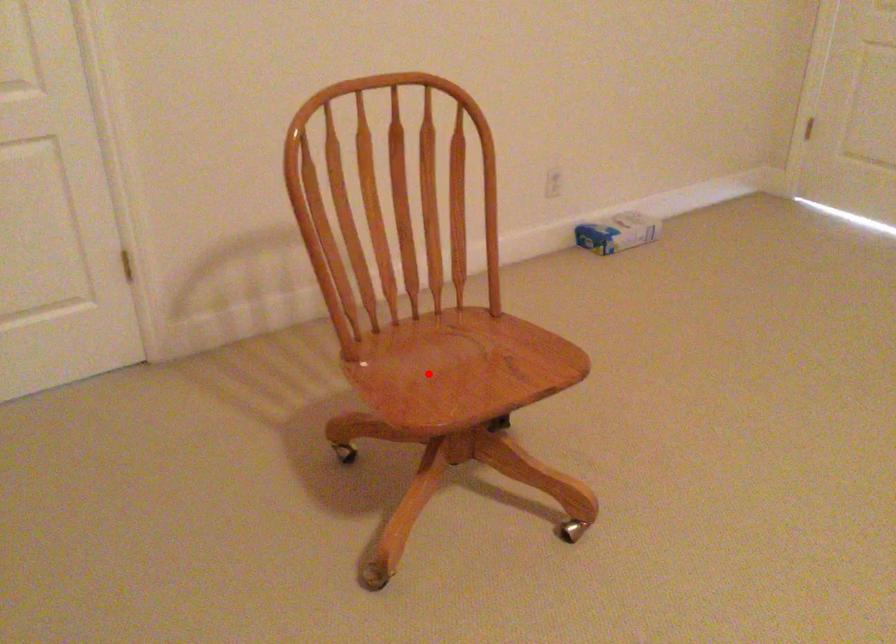
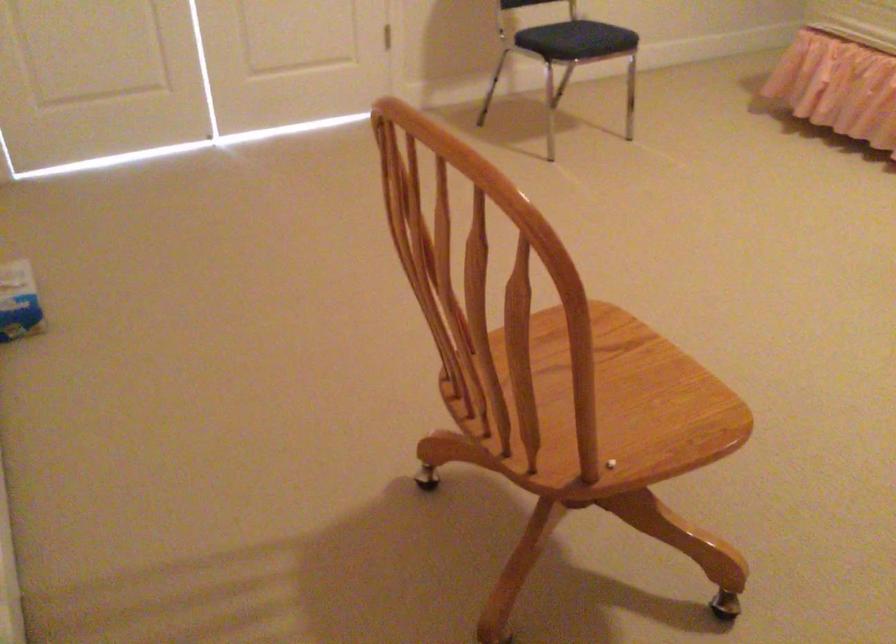
Question: I am providing you with two images of the same scene from different viewpoints. A red point is marked on the first image. At the location where the point appears in image 1, is it still visible in image 2?

Choices:
 (A) Yes
 (B) No

Answer: (B)